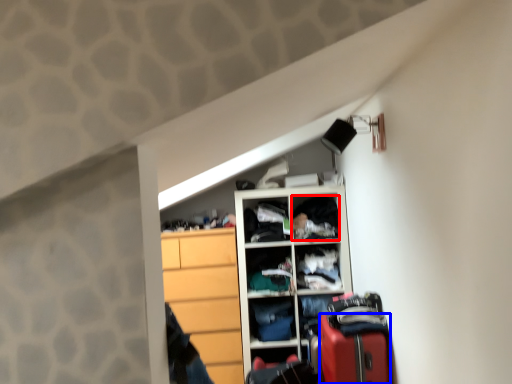
Question: Which point is closer to the camera, clothing (highlighted by a red box) or luggage (highlighted by a blue box)?

Choices:
 (A) clothing
 (B) luggage

Answer: (B)